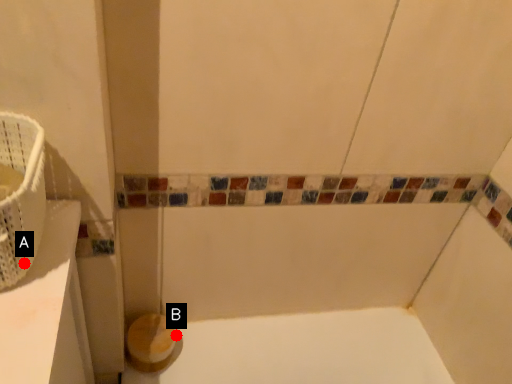
Question: Two points are circled on the image, labeled by A and B beside each circle. Which point is closer to the camera taking this photo?

Choices:
 (A) A is closer
 (B) B is closer

Answer: (A)